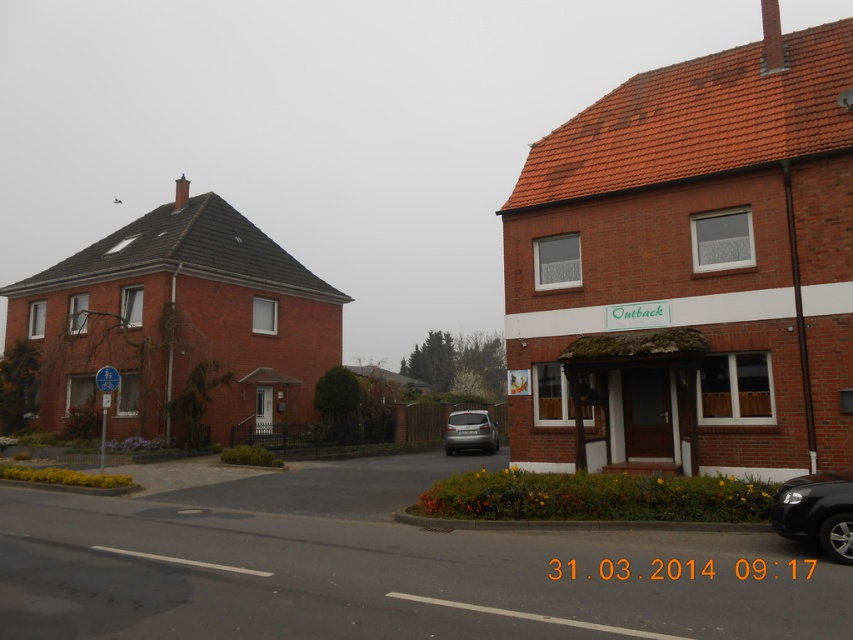
You are a pedestrian standing on the sidewalk and want to cross the street to reach the Outback building. There are two cars in your path. Which car, the shiny black car at lower right or the satin silver car at center, is closer to you as you approach the street?

The satin silver car at center is closer to you because the shiny black car at lower right is positioned above it, indicating it is further away in the scene.

You are a delivery driver who needs to park your vehicle in the parking spot between the shiny black car at lower right and the satin silver car at center. The parking spot is only wide enough for a standard car. Can you fit your truck there?

The shiny black car at lower right is larger than the satin silver car at center. Since the parking spot is only wide enough for a standard car, your truck may not fit due to the limited space between the two cars.

You are a delivery driver who needs to park your vehicle in the parking spot marked at coordinates 0.800, 0.958. Can you safely park your shiny black car at lower right in this spot without any obstructions?

The shiny black car at lower right is located at point (816, 512), so yes, it can be parked there as it is already positioned at the designated coordinates.